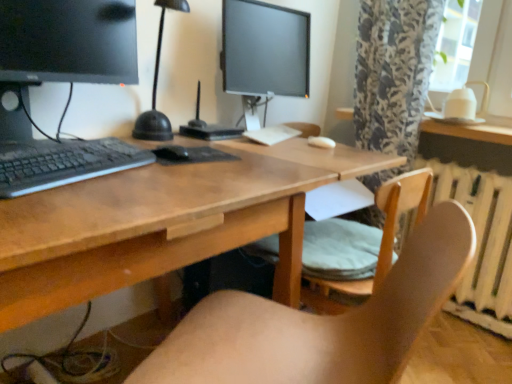
Question: Is wooden chair at center, the second chair in the back-to-front sequence, turned away from wooden desk at center?

Choices:
 (A) no
 (B) yes

Answer: (A)

Question: Would you say wooden chair at center, the second chair in the back-to-front sequence, contains wooden desk at center?

Choices:
 (A) yes
 (B) no

Answer: (B)

Question: Is wooden chair at center, the second chair in the back-to-front sequence, directly adjacent to wooden desk at center?

Choices:
 (A) no
 (B) yes

Answer: (A)

Question: Considering the relative positions of wooden chair at center, the second chair in the back-to-front sequence, and wooden desk at center in the image provided, is wooden chair at center, the second chair in the back-to-front sequence, in front of wooden desk at center?

Choices:
 (A) no
 (B) yes

Answer: (B)

Question: Considering the relative sizes of wooden chair at center, the 1th chair when ordered from front to back, and wooden desk at center in the image provided, is wooden chair at center, the 1th chair when ordered from front to back, thinner than wooden desk at center?

Choices:
 (A) no
 (B) yes

Answer: (B)

Question: From the image's perspective, is matte black monitor at left positioned above or below wooden chair at center, the 1th chair when ordered from front to back?

Choices:
 (A) below
 (B) above

Answer: (B)

Question: In terms of size, does matte black monitor at left appear bigger or smaller than wooden chair at center, the second chair in the back-to-front sequence?

Choices:
 (A) big
 (B) small

Answer: (B)

Question: From a real-world perspective, is matte black monitor at left physically located above or below wooden chair at center, the second chair in the back-to-front sequence?

Choices:
 (A) below
 (B) above

Answer: (B)

Question: Visually, is matte black monitor at left positioned to the left or to the right of wooden chair at center, the second chair in the back-to-front sequence?

Choices:
 (A) left
 (B) right

Answer: (A)

Question: Considering the positions of black matte keyboard at left and satin black monitor at center in the image, is black matte keyboard at left taller or shorter than satin black monitor at center?

Choices:
 (A) tall
 (B) short

Answer: (B)

Question: From a real-world perspective, relative to satin black monitor at center, is black matte keyboard at left vertically above or below?

Choices:
 (A) below
 (B) above

Answer: (A)

Question: Is black matte keyboard at left wider or thinner than satin black monitor at center?

Choices:
 (A) wide
 (B) thin

Answer: (B)

Question: Relative to satin black monitor at center, is black matte keyboard at left in front or behind?

Choices:
 (A) behind
 (B) front

Answer: (B)

Question: From a real-world perspective, is black matte mouse at center positioned above or below wooden chair at lower right, which ranks as the first chair in back-to-front order?

Choices:
 (A) above
 (B) below

Answer: (A)

Question: From the image's perspective, is black matte mouse at center above or below wooden chair at lower right, the second chair viewed from the front?

Choices:
 (A) below
 (B) above

Answer: (B)